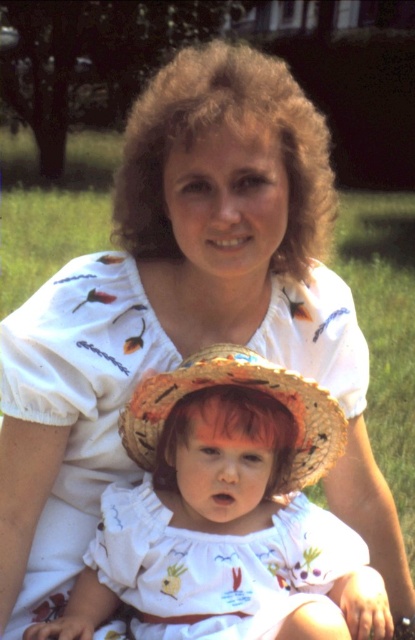
You are a photographer setting up a shot of the scene. You need to ensure that the white cotton dress at center and the natural straw hat at center are both visible in the frame. Given their sizes, which object should you prioritize keeping in focus to ensure it doesn

The white cotton dress at center is taller than the natural straw hat at center, so you should prioritize keeping the white cotton dress at center in focus as it occupies more space in the frame.

You are a tailor measuring the distance between the white cotton dress at center and the natural straw hat at center for a custom accessory. Can you fit a 10 cm long ribbon between them?

The distance between the white cotton dress at center and the natural straw hat at center is 9.27 centimeters, which is shorter than the 10 cm ribbon. Therefore, the ribbon cannot fit between them.